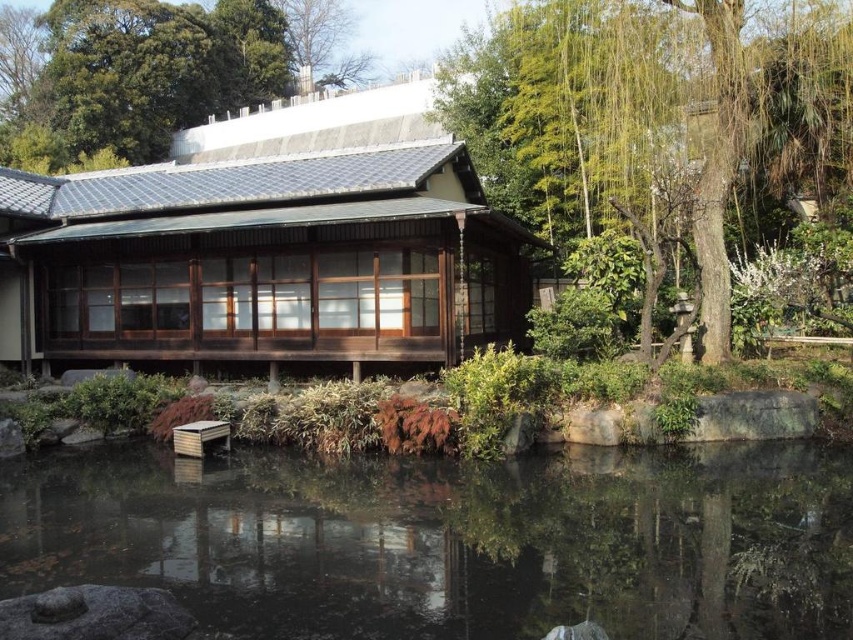
Question: Considering the real-world distances, which object is farthest from the green leafy tree at upper center?

Choices:
 (A) transparent water at pond center
 (B) green leafy tree at right

Answer: (A)

Question: From the image, what is the correct spatial relationship of transparent water at pond center in relation to green leafy tree at right?

Choices:
 (A) left
 (B) right

Answer: (A)

Question: Which is farther from the green leafy tree at upper center?

Choices:
 (A) green leafy tree at right
 (B) transparent water at pond center

Answer: (B)

Question: Among these objects, which one is farthest from the camera?

Choices:
 (A) green leafy tree at upper center
 (B) transparent water at pond center
 (C) green leafy tree at right

Answer: (A)

Question: Is transparent water at pond center wider than green leafy tree at right?

Choices:
 (A) no
 (B) yes

Answer: (B)

Question: Can you confirm if transparent water at pond center is positioned to the right of green leafy tree at upper center?

Choices:
 (A) no
 (B) yes

Answer: (B)